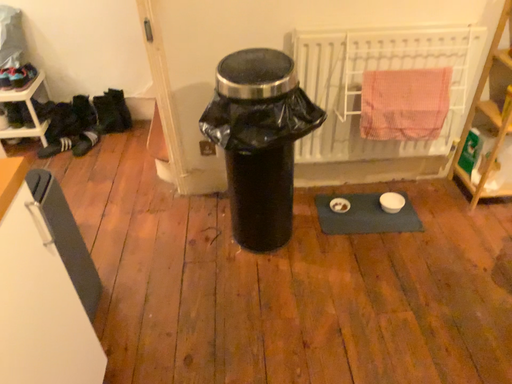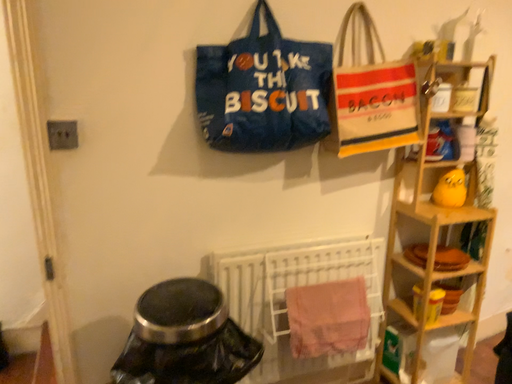
Question: How did the camera likely rotate when shooting the video?

Choices:
 (A) rotated right
 (B) rotated left

Answer: (A)